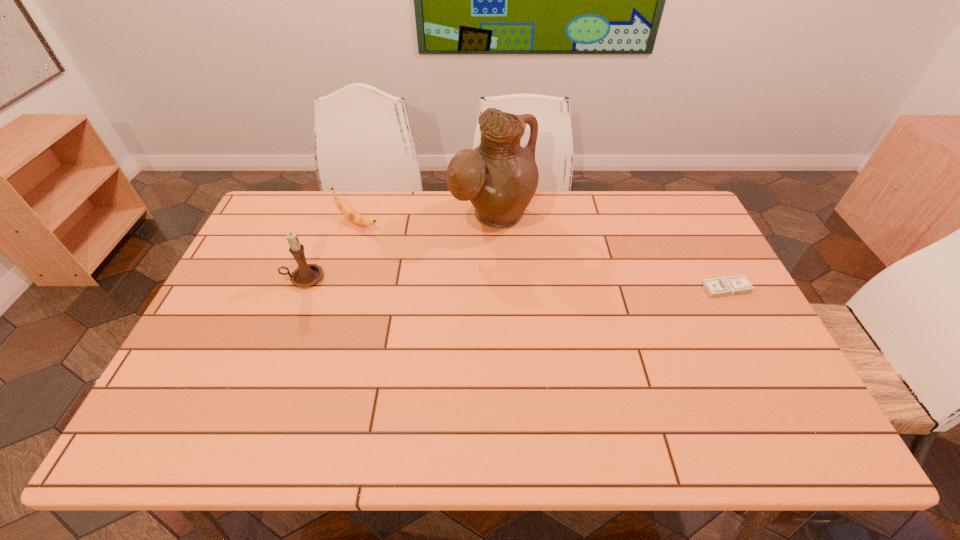
Locate an element on the screen. The height and width of the screenshot is (540, 960). vacant region located 0.100m at the spout of the tallest object is located at coordinates (531, 261).

Find the location of `free space located at the spout of the tallest object`. free space located at the spout of the tallest object is located at coordinates pos(588,328).

The height and width of the screenshot is (540, 960). I want to click on free spot located at the spout of the tallest object, so click(584, 323).

Locate an element on the screen. free location located 0.200m on the peel of the banana from the top is located at coordinates (421, 252).

Locate an element on the screen. vacant space situated on the peel of the banana from the top is located at coordinates (409, 246).

Find the location of a particular element. This screenshot has width=960, height=540. free space located on the peel of the banana from the top is located at coordinates (404, 244).

Find the location of `pitcher present at the far edge`. pitcher present at the far edge is located at coordinates (499, 177).

Find the location of a particular element. The image size is (960, 540). banana that is at the far edge is located at coordinates (350, 214).

The width and height of the screenshot is (960, 540). I want to click on object that is at the left edge, so click(305, 275).

At what (x,y) coordinates should I click in order to perform the action: click on object at the right edge. Please return your answer as a coordinate pair (x, y). The height and width of the screenshot is (540, 960). Looking at the image, I should click on (730, 285).